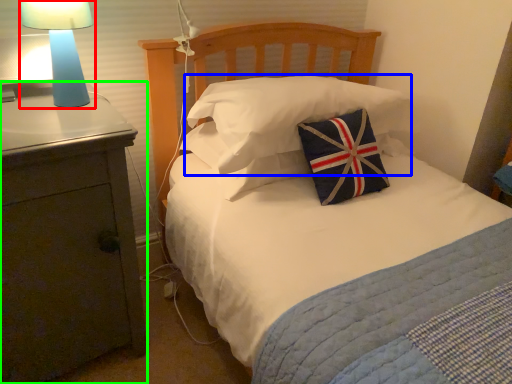
Question: Which object is positioned closest to lamp (highlighted by a red box)? Select from pillow (highlighted by a blue box) and nightstand (highlighted by a green box).

Choices:
 (A) pillow
 (B) nightstand

Answer: (B)